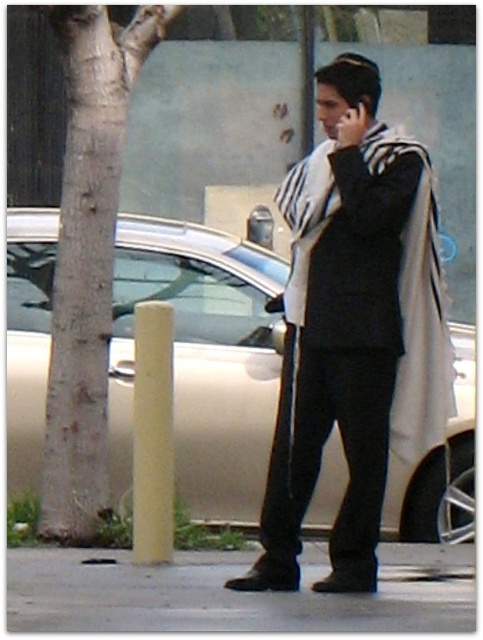
Question: Does striped wool scarf at center lie in front of black plastic phone at upper center?

Choices:
 (A) yes
 (B) no

Answer: (A)

Question: Based on their relative distances, which object is nearer to the black plastic phone at upper center?

Choices:
 (A) gray bark tree at left
 (B) striped wool scarf at center
 (C) silver metallic car at center

Answer: (B)

Question: Which of the following is the farthest from the observer?

Choices:
 (A) (103, 100)
 (B) (356, 102)

Answer: (A)

Question: Which is nearer to the gray bark tree at left?

Choices:
 (A) silver metallic car at center
 (B) gray concrete sidewalk at lower center
 (C) striped wool scarf at center

Answer: (A)

Question: Where is striped wool scarf at center located in relation to black plastic phone at upper center in the image?

Choices:
 (A) left
 (B) right

Answer: (B)

Question: Is striped wool scarf at center smaller than gray concrete sidewalk at lower center?

Choices:
 (A) no
 (B) yes

Answer: (A)